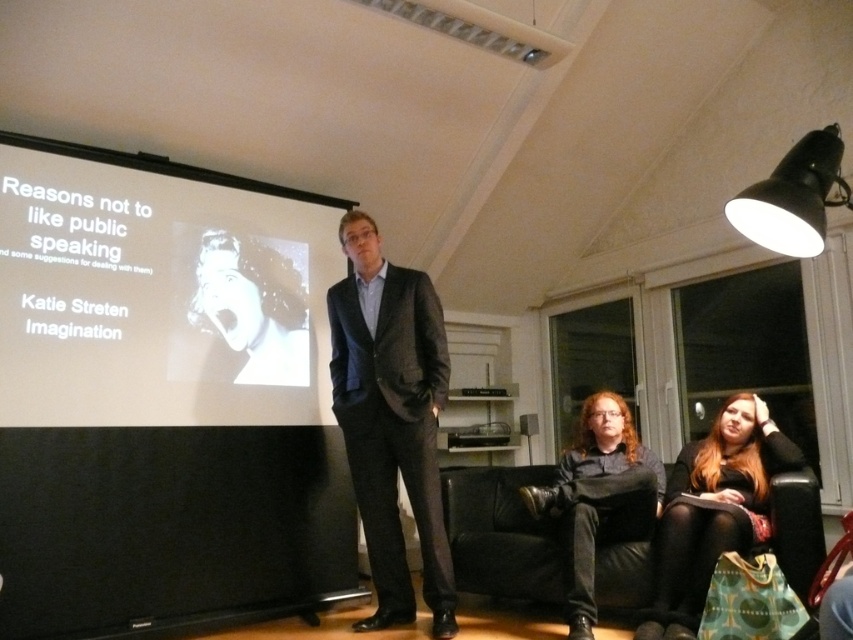
Question: Estimate the real-world distances between objects in this image. Which object is closer to the black metal lamp at upper right?

Choices:
 (A) white matte projection screen at upper left
 (B) dark brown leather jacket at lower center
 (C) dark gray textured suit at center

Answer: (B)

Question: Which of the following is the farthest from the observer?

Choices:
 (A) matte black suit at center
 (B) dark brown leather jacket at lower center
 (C) long brown hair at lower right
 (D) white matte projection screen at upper left

Answer: (A)

Question: Among these objects, which one is farthest from the camera?

Choices:
 (A) black metal lamp at upper right
 (B) long brown hair at lower right

Answer: (B)

Question: Is dark gray textured suit at center thinner than black metal lamp at upper right?

Choices:
 (A) yes
 (B) no

Answer: (B)

Question: Observing the image, what is the correct spatial positioning of dark gray textured suit at center in reference to matte black suit at center?

Choices:
 (A) left
 (B) right

Answer: (A)

Question: Can you confirm if white matte projection screen at upper left is smaller than dark brown leather jacket at lower center?

Choices:
 (A) yes
 (B) no

Answer: (B)